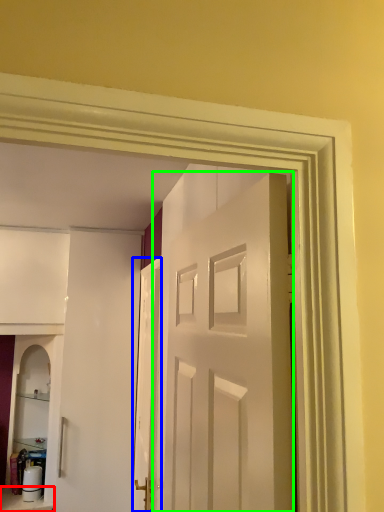
Question: Based on their relative distances, which object is farther from furniture (highlighted by a red box)? Choose from door (highlighted by a blue box) and door (highlighted by a green box).

Choices:
 (A) door
 (B) door

Answer: (B)